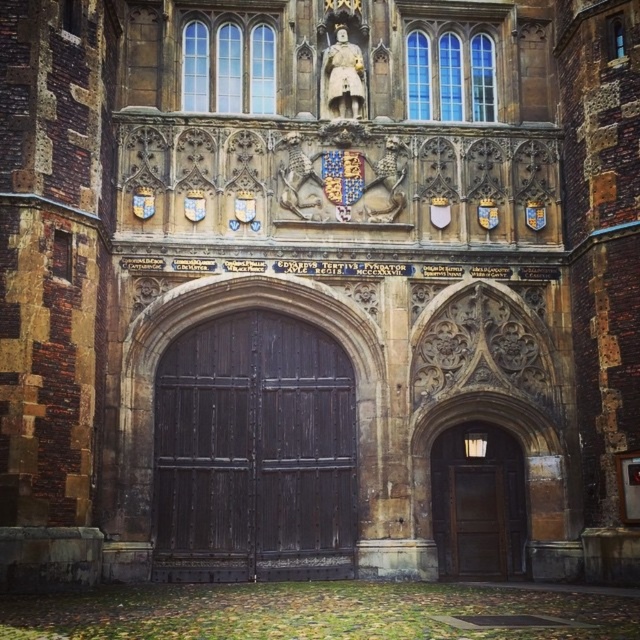
Question: Which of the following is the farthest from the observer?

Choices:
 (A) pos(467,561)
 (B) pos(508,513)

Answer: (B)

Question: In this image, where is dark wood door at center located relative to brown wooden door at lower right?

Choices:
 (A) below
 (B) above

Answer: (B)

Question: Which point is farther to the camera?

Choices:
 (A) (170, 570)
 (B) (524, 570)
 (C) (468, 499)

Answer: (C)

Question: Can you confirm if brown wooden door at center is wider than brown wooden door at lower right?

Choices:
 (A) yes
 (B) no

Answer: (A)

Question: Is dark wood door at center positioned in front of brown wooden door at center?

Choices:
 (A) no
 (B) yes

Answer: (B)

Question: Among these points, which one is nearest to the camera?

Choices:
 (A) (502, 566)
 (B) (500, 554)

Answer: (A)